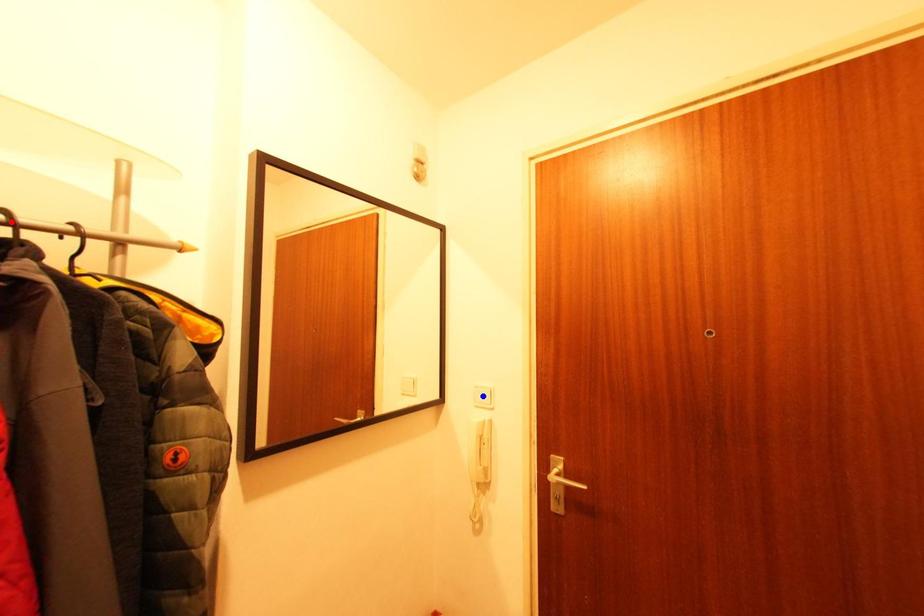
Question: Which of the two points in the image is closer to the camera?

Choices:
 (A) Blue point is closer.
 (B) Red point is closer.

Answer: (B)